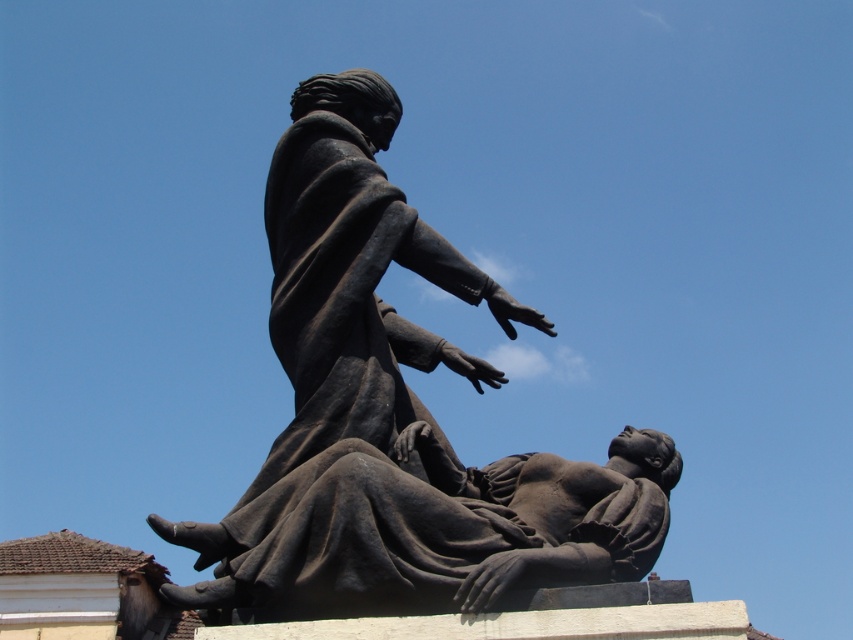
You are an art curator planning to display both the bronze statue at center and the matte black statue at center in an outdoor exhibition. Given their sizes, which statue would require more space to accommodate its dimensions?

The bronze statue at center requires more space because it has a larger size compared to the matte black statue at center.

You are an art curator planning to move the bronze statue at center and the matte black statue at center closer together for an exhibition. The gallery requires that the statues must be exactly 1.5 meters apart. Can you adjust their positions to meet this requirement?

The bronze statue at center and matte black statue at center are currently 1.62 meters apart. Since 1.62 meters is greater than the required 1.5 meters, you can move them closer to achieve the desired distance.